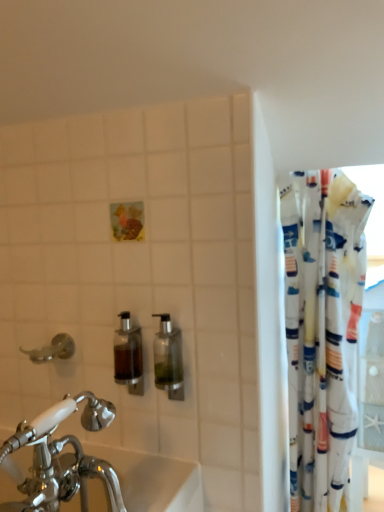
Question: Can you confirm if brushed metal faucet at left is shorter than white fabric curtain at right?

Choices:
 (A) no
 (B) yes

Answer: (B)

Question: From a real-world perspective, is brushed metal faucet at left on white fabric curtain at right?

Choices:
 (A) no
 (B) yes

Answer: (B)

Question: Does brushed metal faucet at left come in front of white fabric curtain at right?

Choices:
 (A) no
 (B) yes

Answer: (A)

Question: Is brushed metal faucet at left surrounding white fabric curtain at right?

Choices:
 (A) no
 (B) yes

Answer: (A)

Question: Is the surface of brushed metal faucet at left in direct contact with white fabric curtain at right?

Choices:
 (A) yes
 (B) no

Answer: (B)

Question: Are brushed metal faucet at left and white fabric curtain at right located far from each other?

Choices:
 (A) yes
 (B) no

Answer: (B)

Question: Is translucent glass soap dispenser at center, the 1th soap dispenser viewed from the left, wider than white fabric curtain at right?

Choices:
 (A) no
 (B) yes

Answer: (A)

Question: Is translucent glass soap dispenser at center, acting as the second soap dispenser starting from the right, positioned before white fabric curtain at right?

Choices:
 (A) yes
 (B) no

Answer: (A)

Question: Does translucent glass soap dispenser at center, the 1th soap dispenser viewed from the left, appear on the right side of white fabric curtain at right?

Choices:
 (A) yes
 (B) no

Answer: (B)

Question: Does translucent glass soap dispenser at center, acting as the second soap dispenser starting from the right, have a lesser width compared to white fabric curtain at right?

Choices:
 (A) no
 (B) yes

Answer: (B)

Question: Does translucent glass soap dispenser at center, acting as the second soap dispenser starting from the right, have a greater height compared to white fabric curtain at right?

Choices:
 (A) yes
 (B) no

Answer: (B)

Question: From a real-world perspective, does translucent glass soap dispenser at center, acting as the second soap dispenser starting from the right, stand above white fabric curtain at right?

Choices:
 (A) yes
 (B) no

Answer: (A)

Question: Considering the relative positions of white fabric curtain at right and clear glass soap dispenser at center, arranged as the second soap dispenser when viewed from the left, in the image provided, is white fabric curtain at right to the left of clear glass soap dispenser at center, arranged as the second soap dispenser when viewed from the left, from the viewer's perspective?

Choices:
 (A) yes
 (B) no

Answer: (B)